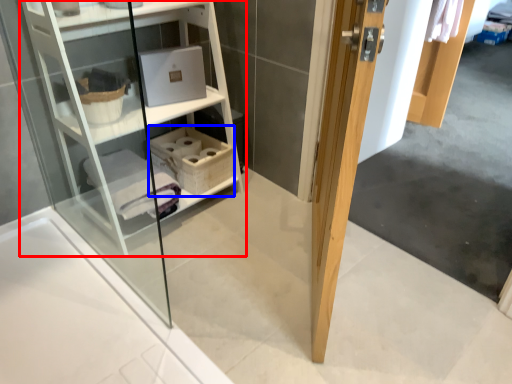
Question: Which object is closer to the camera taking this photo, shelf (highlighted by a red box) or basket (highlighted by a blue box)?

Choices:
 (A) shelf
 (B) basket

Answer: (A)